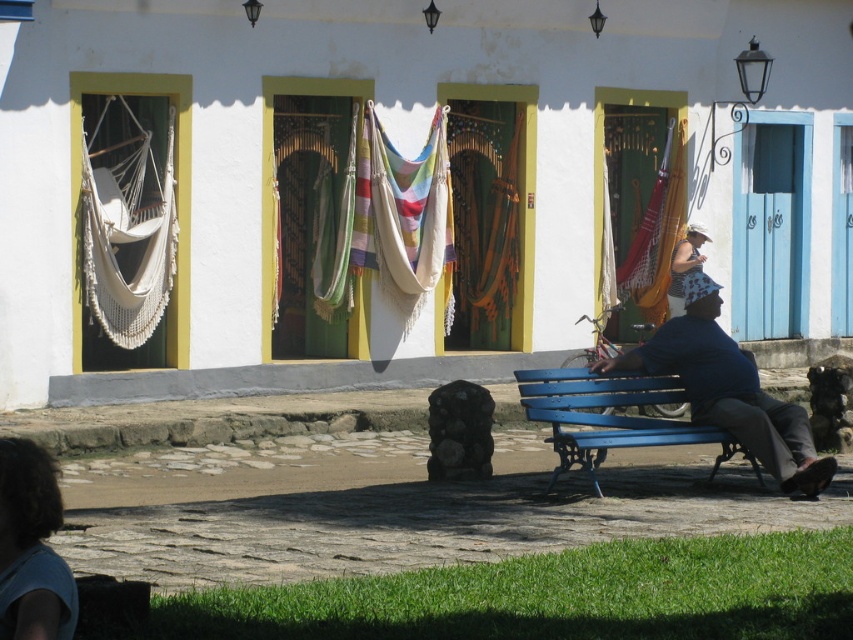
You are standing at the entrance of the white building with yellow doors. You notice a bright blue bench on the cobblestone path. Where is the point located at coordinates (728, 388) in relation to the blue bench?

The point at (728, 388) corresponds to the blue fabric shirt at lower right, which is located near the blue bench on the cobblestone path.